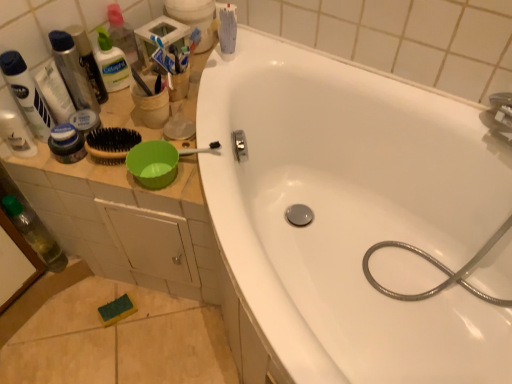
Question: Is shiny metallic can at upper left, the 4th toiletry from the left, aimed at clear plastic bottle at upper left, marked as the first bottle in a top-to-bottom arrangement?

Choices:
 (A) no
 (B) yes

Answer: (A)

Question: Is shiny metallic can at upper left, the 1th toiletry viewed from the right, completely or partially outside of clear plastic bottle at upper left, positioned as the second bottle in left-to-right order?

Choices:
 (A) yes
 (B) no

Answer: (A)

Question: Is shiny metallic can at upper left, the 1th toiletry viewed from the right, taller than clear plastic bottle at upper left, the 2th bottle positioned from the bottom?

Choices:
 (A) no
 (B) yes

Answer: (B)

Question: Does shiny metallic can at upper left, the 4th toiletry from the left, have a lesser height compared to clear plastic bottle at upper left, marked as the first bottle in a top-to-bottom arrangement?

Choices:
 (A) no
 (B) yes

Answer: (A)

Question: Is shiny metallic can at upper left, the 4th toiletry from the left, oriented away from clear plastic bottle at upper left, which is the 1th bottle in right-to-left order?

Choices:
 (A) no
 (B) yes

Answer: (A)

Question: Is metallic silver garden hose at upper right spatially inside matte white tube at upper left, the 2th toiletry viewed from the left, or outside of it?

Choices:
 (A) inside
 (B) outside

Answer: (B)

Question: Relative to matte white tube at upper left, the third toiletry from the right, is metallic silver garden hose at upper right in front or behind?

Choices:
 (A) behind
 (B) front

Answer: (B)

Question: Is metallic silver garden hose at upper right bigger or smaller than matte white tube at upper left, the third toiletry from the right?

Choices:
 (A) big
 (B) small

Answer: (A)

Question: Is metallic silver garden hose at upper right taller or shorter than matte white tube at upper left, the third toiletry from the right?

Choices:
 (A) tall
 (B) short

Answer: (A)

Question: Considering the positions of white glossy bathtub at upper center and brown bristle brush at upper left in the image, is white glossy bathtub at upper center wider or thinner than brown bristle brush at upper left?

Choices:
 (A) wide
 (B) thin

Answer: (A)

Question: From the image's perspective, relative to brown bristle brush at upper left, is white glossy bathtub at upper center above or below?

Choices:
 (A) above
 (B) below

Answer: (B)

Question: Considering the positions of white glossy bathtub at upper center and brown bristle brush at upper left in the image, is white glossy bathtub at upper center taller or shorter than brown bristle brush at upper left?

Choices:
 (A) short
 (B) tall

Answer: (B)

Question: Would you say white glossy bathtub at upper center is to the left or to the right of brown bristle brush at upper left in the picture?

Choices:
 (A) left
 (B) right

Answer: (B)

Question: Choose the correct answer: Is white glossy bathtub at upper center inside clear plastic bottle at upper left, positioned as the second bottle in left-to-right order, or outside it?

Choices:
 (A) inside
 (B) outside

Answer: (B)

Question: Is white glossy bathtub at upper center bigger or smaller than clear plastic bottle at upper left, which is the 1th bottle in right-to-left order?

Choices:
 (A) small
 (B) big

Answer: (B)